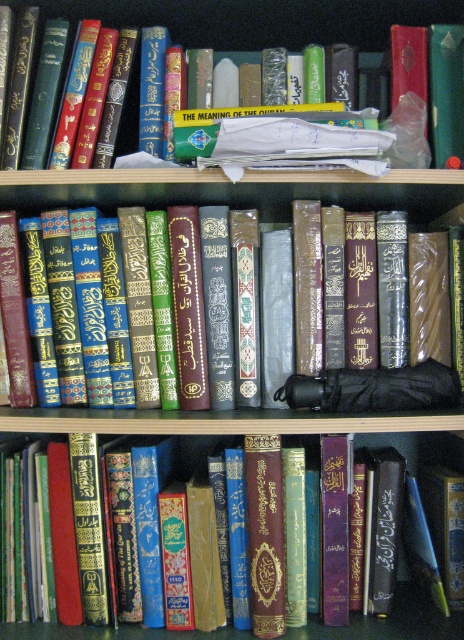
Question: Can you confirm if green leather book at upper center is thinner than gold embossed book at center?

Choices:
 (A) yes
 (B) no

Answer: (B)

Question: Estimate the real-world distances between objects in this image. Which object is closer to the green leather book at center?

Choices:
 (A) gold embossed book at center
 (B) green leather book at upper center

Answer: (A)

Question: Can you confirm if green leather book at upper center is wider than gold embossed book at center?

Choices:
 (A) yes
 (B) no

Answer: (A)

Question: Estimate the real-world distances between objects in this image. Which object is farther from the green leather book at upper center?

Choices:
 (A) green leather book at center
 (B) gold embossed book at center

Answer: (A)

Question: In this image, where is green leather book at center located relative to gold embossed book at center?

Choices:
 (A) right
 (B) left

Answer: (B)

Question: Which point appears closest to the camera in this image?

Choices:
 (A) (113, 636)
 (B) (368, 44)
 (C) (440, 269)

Answer: (A)